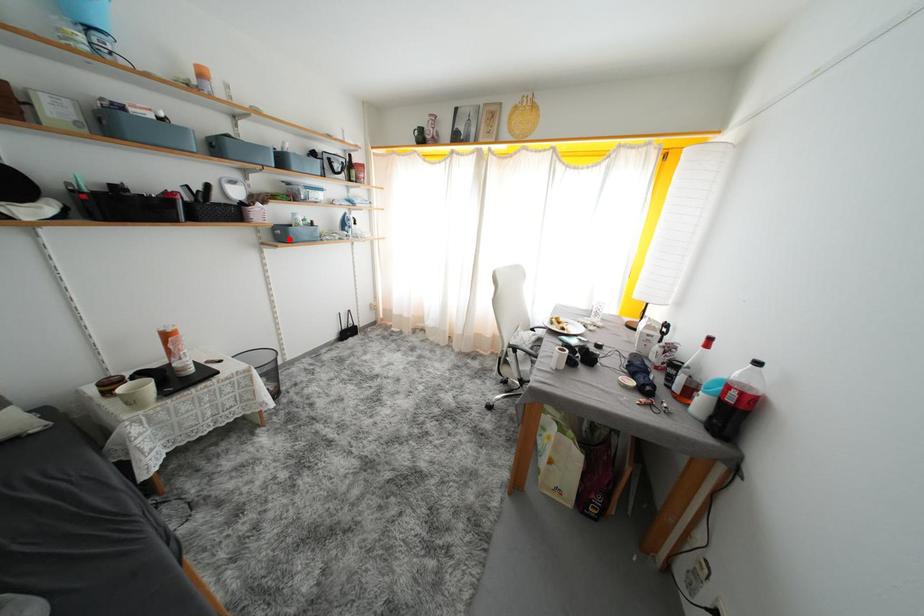
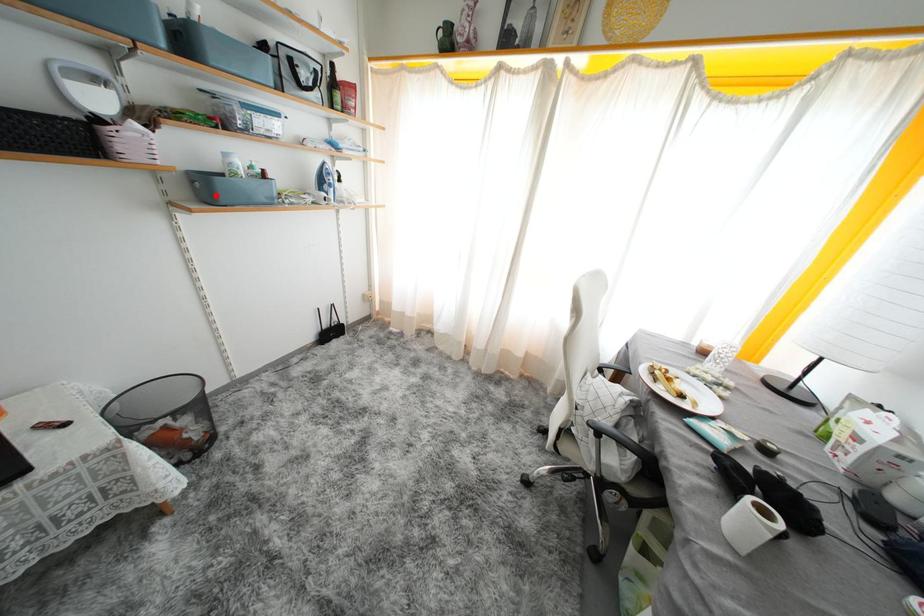
I am providing you with two images of the same scene from different viewpoints. A red point is marked on the first image and another point is marked on the second image. Do the highlighted points in image1 and image2 indicate the same real-world spot?

Yes